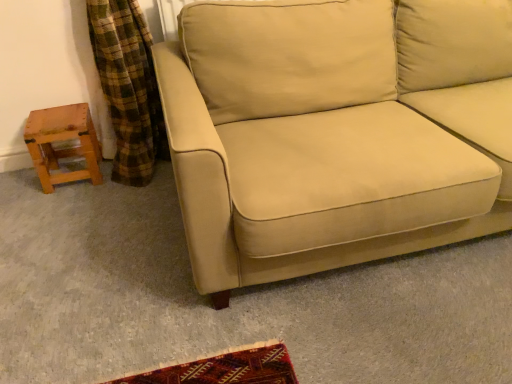
Measure the distance between point (97,142) and camera.

The distance of point (97,142) from camera is 2.01 meters.

What are the coordinates of `wooden stool at left` in the screenshot? It's located at (62, 140).

Describe the element at coordinates (62, 140) in the screenshot. Image resolution: width=512 pixels, height=384 pixels. I see `wooden stool at left` at that location.

The image size is (512, 384). I want to click on beige fabric couch at center, so click(335, 132).

What is the approximate height of beige fabric couch at center?

beige fabric couch at center is 30.81 inches in height.

The width and height of the screenshot is (512, 384). Describe the element at coordinates (335, 132) in the screenshot. I see `beige fabric couch at center` at that location.

You are a GUI agent. You are given a task and a screenshot of the screen. Output one action in this format:
    pyautogui.click(x=<x>, y=<y>)
    Task: Click on the wooden stool at left
    The image size is (512, 384).
    Given the screenshot: What is the action you would take?
    pyautogui.click(x=62, y=140)

In the scene shown: Which object is positioned more to the left, beige fabric couch at center or wooden stool at left?

wooden stool at left.

Is beige fabric couch at center behind wooden stool at left?

No, beige fabric couch at center is closer to the viewer.

Between point (249, 72) and point (49, 184), which one is positioned behind?

The point (49, 184) is more distant.

From the image's perspective, is beige fabric couch at center under wooden stool at left?

No, from the image's perspective, beige fabric couch at center is not beneath wooden stool at left.

From a real-world perspective, is beige fabric couch at center beneath wooden stool at left?

No, from a real-world perspective, beige fabric couch at center is not under wooden stool at left.

Does beige fabric couch at center have a greater width compared to wooden stool at left?

Yes, beige fabric couch at center is wider than wooden stool at left.

Considering the sizes of objects beige fabric couch at center and wooden stool at left in the image provided, who is taller, beige fabric couch at center or wooden stool at left?

beige fabric couch at center is taller.

Can you confirm if beige fabric couch at center is bigger than wooden stool at left?

Indeed, beige fabric couch at center has a larger size compared to wooden stool at left.

Which is correct: beige fabric couch at center is inside wooden stool at left, or outside of it?

The correct answer is: outside.

Is beige fabric couch at center with wooden stool at left?

No, beige fabric couch at center is not beside wooden stool at left.

Is beige fabric couch at center oriented towards wooden stool at left?

No.

How many degrees apart are the facing directions of beige fabric couch at center and wooden stool at left?

The facing directions of beige fabric couch at center and wooden stool at left are 1.72 degrees apart.

You are a GUI agent. You are given a task and a screenshot of the screen. Output one action in this format:
    pyautogui.click(x=<x>, y=<y>)
    Task: Click on the studio couch that appears on the right of wooden stool at left
    
    Given the screenshot: What is the action you would take?
    pyautogui.click(x=335, y=132)

Between wooden stool at left and beige fabric couch at center, which one appears on the right side from the viewer's perspective?

Positioned to the right is beige fabric couch at center.

In the image, is wooden stool at left positioned in front of or behind beige fabric couch at center?

wooden stool at left is positioned farther from the viewer than beige fabric couch at center.

Is point (50, 133) positioned after point (416, 199)?

That is True.

From the image's perspective, is wooden stool at left on beige fabric couch at center?

No.

From the picture: From a real-world perspective, which is physically above, wooden stool at left or beige fabric couch at center?

In real-world perspective, beige fabric couch at center is above.

Between wooden stool at left and beige fabric couch at center, which one has larger width?

beige fabric couch at center.

Considering the sizes of objects wooden stool at left and beige fabric couch at center in the image provided, who is taller, wooden stool at left or beige fabric couch at center?

beige fabric couch at center is taller.

Is wooden stool at left bigger or smaller than beige fabric couch at center?

Considering their sizes, wooden stool at left takes up less space than beige fabric couch at center.

Would you say wooden stool at left is outside beige fabric couch at center?

wooden stool at left is positioned outside beige fabric couch at center.

Are wooden stool at left and beige fabric couch at center making contact?

No, wooden stool at left is not next to beige fabric couch at center.

Is wooden stool at left looking in the opposite direction of beige fabric couch at center?

No, wooden stool at left's orientation is not away from beige fabric couch at center.

In the scene shown: How different are the orientations of wooden stool at left and beige fabric couch at center in degrees?

The angle between the facing direction of wooden stool at left and the facing direction of beige fabric couch at center is 1.72 degrees.

This screenshot has width=512, height=384. I want to click on studio couch above the wooden stool at left (from a real-world perspective), so click(x=335, y=132).

What are the coordinates of `studio couch located above the wooden stool at left (from the image's perspective)` in the screenshot? It's located at (335, 132).

The height and width of the screenshot is (384, 512). Find the location of `studio couch above the wooden stool at left (from a real-world perspective)`. studio couch above the wooden stool at left (from a real-world perspective) is located at coordinates (335, 132).